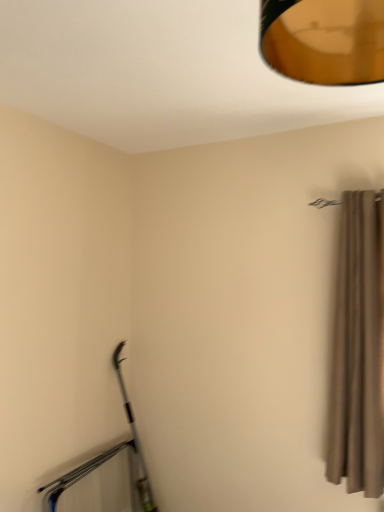
The image size is (384, 512). I want to click on matte beige curtain at right, so click(x=358, y=348).

What do you see at coordinates (358, 348) in the screenshot? I see `matte beige curtain at right` at bounding box center [358, 348].

The image size is (384, 512). Find the location of `matte beige curtain at right`. matte beige curtain at right is located at coordinates (358, 348).